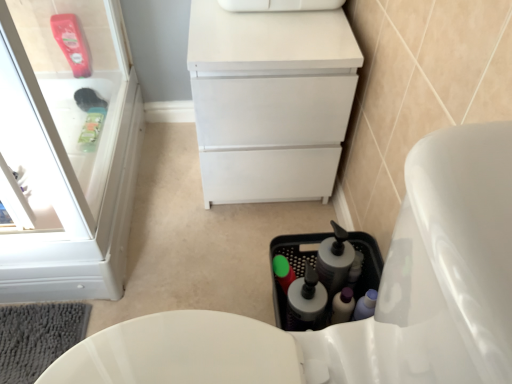
Question: Which direction should I rotate to look at translucent plastic bottle at lower center, the second bottle in the left-to-right sequence?

Choices:
 (A) right
 (B) left

Answer: (A)

Question: From the image's perspective, is white plastic cabinet at upper left on top of translucent plastic bottle at lower center, the second bottle in the left-to-right sequence?

Choices:
 (A) no
 (B) yes

Answer: (B)

Question: From a real-world perspective, is white plastic cabinet at upper left beneath translucent plastic bottle at lower center, the first bottle in the right-to-left sequence?

Choices:
 (A) yes
 (B) no

Answer: (B)

Question: Is white plastic cabinet at upper left closer to the viewer compared to translucent plastic bottle at lower center, the first bottle in the right-to-left sequence?

Choices:
 (A) yes
 (B) no

Answer: (A)

Question: Does white plastic cabinet at upper left appear on the left side of translucent plastic bottle at lower center, the second bottle in the left-to-right sequence?

Choices:
 (A) no
 (B) yes

Answer: (B)

Question: From the image's perspective, does white plastic cabinet at upper left appear lower than translucent plastic bottle at lower center, the first bottle in the right-to-left sequence?

Choices:
 (A) no
 (B) yes

Answer: (A)

Question: Considering the relative sizes of white plastic cabinet at upper left and translucent plastic bottle at lower center, the first bottle in the right-to-left sequence, in the image provided, is white plastic cabinet at upper left shorter than translucent plastic bottle at lower center, the first bottle in the right-to-left sequence,?

Choices:
 (A) yes
 (B) no

Answer: (B)

Question: Is white matte cabinet at center behind translucent plastic bottle at lower center, the second bottle in the left-to-right sequence?

Choices:
 (A) no
 (B) yes

Answer: (B)

Question: Is white matte cabinet at center facing towards translucent plastic bottle at lower center, the first bottle in the right-to-left sequence?

Choices:
 (A) yes
 (B) no

Answer: (A)

Question: Does white matte cabinet at center have a lesser height compared to translucent plastic bottle at lower center, the first bottle in the right-to-left sequence?

Choices:
 (A) yes
 (B) no

Answer: (B)

Question: From the image's perspective, does white matte cabinet at center appear higher than translucent plastic bottle at lower center, the second bottle in the left-to-right sequence?

Choices:
 (A) yes
 (B) no

Answer: (A)

Question: Is translucent plastic bottle at lower center, the second bottle in the left-to-right sequence, located within white matte cabinet at center?

Choices:
 (A) no
 (B) yes

Answer: (A)

Question: Is white matte cabinet at center thinner than translucent plastic bottle at lower center, the first bottle in the right-to-left sequence?

Choices:
 (A) yes
 (B) no

Answer: (B)

Question: Considering the relative sizes of translucent plastic bottle at lower center, the first bottle in the right-to-left sequence, and white plastic cabinet at upper left in the image provided, is translucent plastic bottle at lower center, the first bottle in the right-to-left sequence, wider than white plastic cabinet at upper left?

Choices:
 (A) no
 (B) yes

Answer: (B)